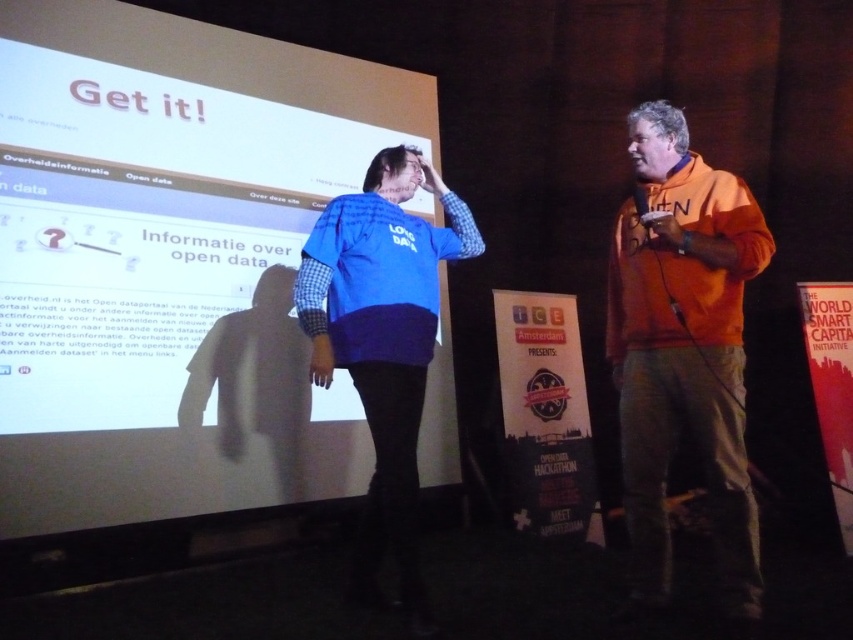
Is point (733, 368) behind point (354, 202)?

No.

The width and height of the screenshot is (853, 640). Identify the location of orange fleece jacket at right. (683, 349).

Describe the element at coordinates (683, 349) in the screenshot. Image resolution: width=853 pixels, height=640 pixels. I see `orange fleece jacket at right` at that location.

I want to click on orange fleece jacket at right, so click(683, 349).

Describe the element at coordinates (171, 260) in the screenshot. I see `white matte projection screen at upper center` at that location.

Image resolution: width=853 pixels, height=640 pixels. Identify the location of white matte projection screen at upper center. (171, 260).

The height and width of the screenshot is (640, 853). What do you see at coordinates (171, 260) in the screenshot?
I see `white matte projection screen at upper center` at bounding box center [171, 260].

Locate an element on the screen. Image resolution: width=853 pixels, height=640 pixels. white matte projection screen at upper center is located at coordinates (171, 260).

Does point (83, 464) come farther from viewer compared to point (343, 348)?

Yes, it is behind point (343, 348).

Who is more distant from viewer, (80,216) or (322,221)?

Point (80,216)

Describe the element at coordinates (171, 260) in the screenshot. The height and width of the screenshot is (640, 853). I see `white matte projection screen at upper center` at that location.

Where is `white matte projection screen at upper center`? The width and height of the screenshot is (853, 640). white matte projection screen at upper center is located at coordinates (171, 260).